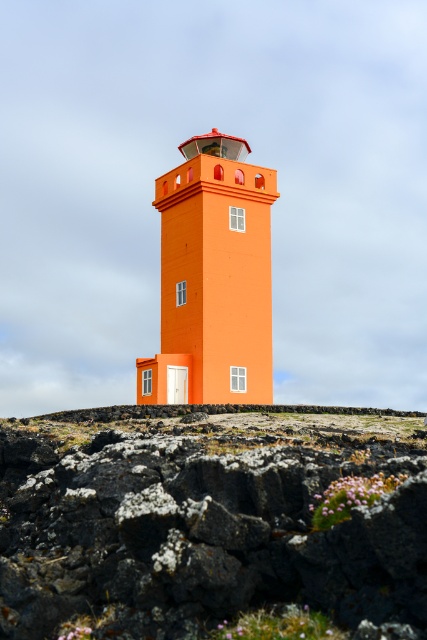
This screenshot has height=640, width=427. What do you see at coordinates (207, 520) in the screenshot? I see `volcanic rock at center` at bounding box center [207, 520].

Between point (26, 506) and point (187, 273), which one is positioned in front?

Positioned in front is point (26, 506).

Between point (290, 420) and point (163, 184), which one is positioned behind?

The point (163, 184) is behind.

The image size is (427, 640). I want to click on volcanic rock at center, so click(207, 520).